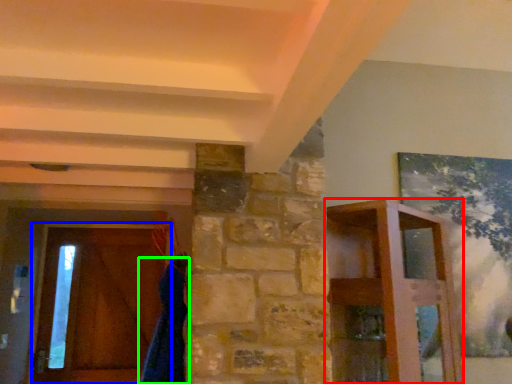
Question: Based on their relative distances, which object is farther from furniture (highlighted by a red box)? Choose from barn door (highlighted by a blue box) and robe (highlighted by a green box).

Choices:
 (A) barn door
 (B) robe

Answer: (A)